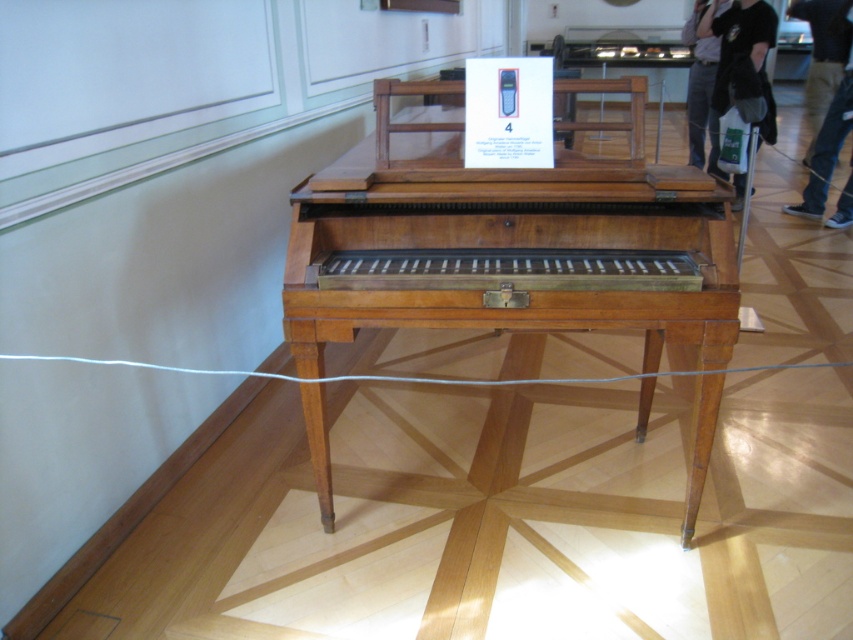
Does wooden piano at center have a smaller size compared to black fabric bag at upper right?

No.

Identify the location of wooden piano at center. (503, 236).

Is point (473, 257) farther from viewer compared to point (761, 129)?

That is False.

I want to click on wooden piano at center, so click(x=503, y=236).

The height and width of the screenshot is (640, 853). What do you see at coordinates (827, 147) in the screenshot?
I see `brown denim pants at lower right` at bounding box center [827, 147].

This screenshot has height=640, width=853. I want to click on brown denim pants at lower right, so click(x=827, y=147).

Is wooden piano at center smaller than brown denim pants at lower right?

No.

Does wooden piano at center come in front of brown denim pants at lower right?

Yes, it is.

Is point (392, 140) farther from viewer compared to point (828, 136)?

That is False.

Identify the location of wooden piano at center. (503, 236).